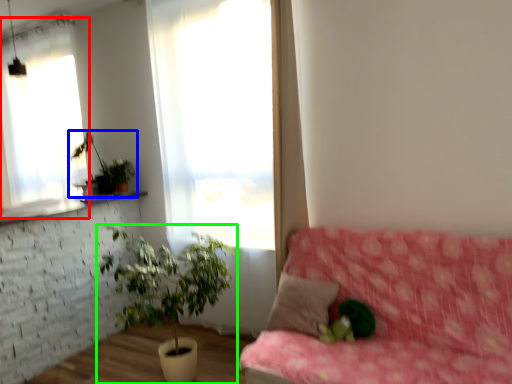
Question: Which object is the farthest from window (highlighted by a red box)? Choose among these: houseplant (highlighted by a blue box) or houseplant (highlighted by a green box).

Choices:
 (A) houseplant
 (B) houseplant

Answer: (B)